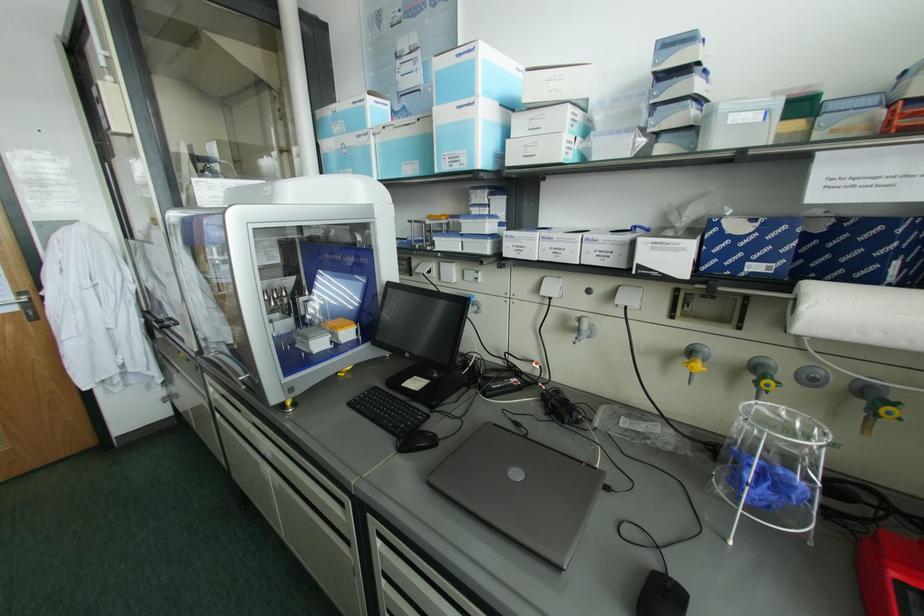
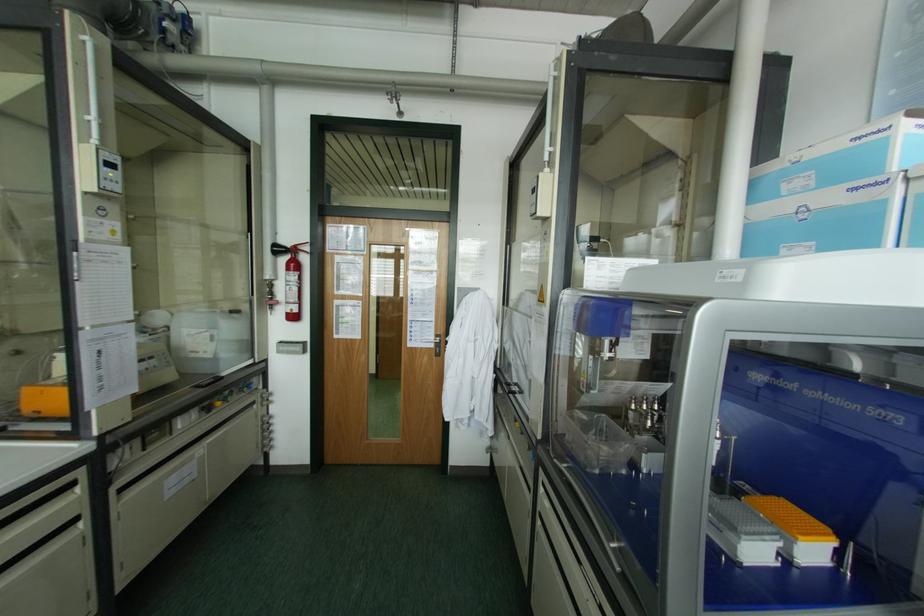
Question: Based on the continuous images, in which direction is the camera rotating? Reply with the corresponding letter.

Choices:
 (A) Left
 (B) Right
 (C) Up
 (D) Down

Answer: (A)